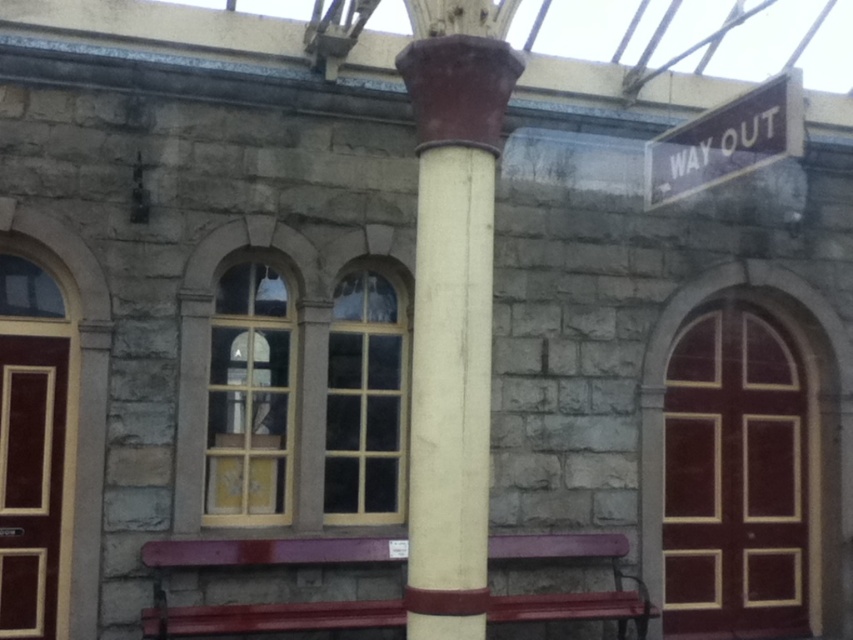
Question: Which of these objects is positioned closest to the maroon painted wood bench at center?

Choices:
 (A) brown wooden sign at upper right
 (B) white glossy column at center

Answer: (B)

Question: Is white glossy column at center thinner than brown wooden sign at upper right?

Choices:
 (A) no
 (B) yes

Answer: (A)

Question: Based on their relative distances, which object is nearer to the maroon painted wood bench at center?

Choices:
 (A) brown wooden sign at upper right
 (B) white glossy column at center

Answer: (B)

Question: Is white glossy column at center closer to camera compared to brown wooden sign at upper right?

Choices:
 (A) yes
 (B) no

Answer: (A)

Question: Does maroon painted wood bench at center appear under brown wooden sign at upper right?

Choices:
 (A) yes
 (B) no

Answer: (A)

Question: Based on their relative distances, which object is farther from the white glossy column at center?

Choices:
 (A) brown wooden sign at upper right
 (B) maroon painted wood bench at center

Answer: (B)